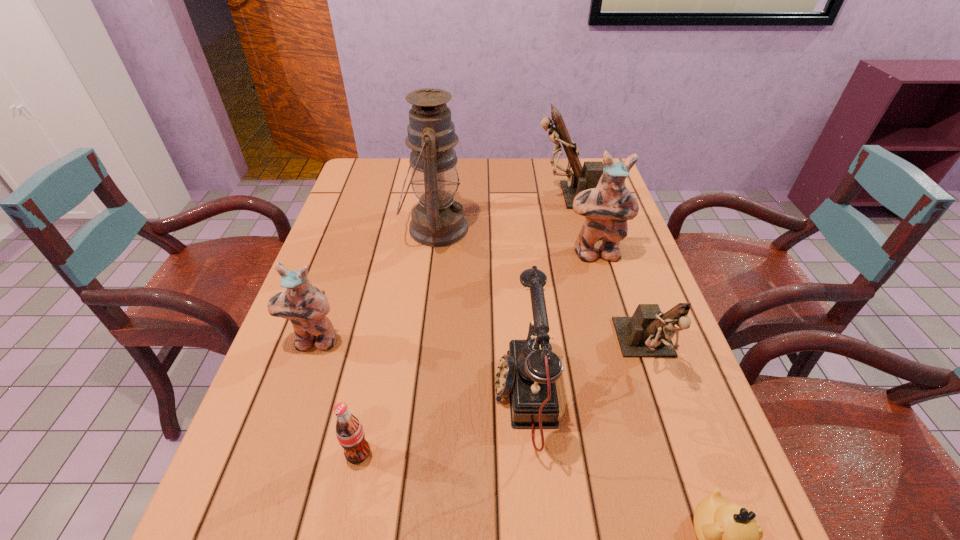
In order to click on the tallest object in this screenshot , I will do `click(437, 221)`.

You are a GUI agent. You are given a task and a screenshot of the screen. Output one action in this format:
    pyautogui.click(x=<x>, y=<y>)
    Task: Click on the brown oil lamp
    This screenshot has height=540, width=960.
    Given the screenshot: What is the action you would take?
    pyautogui.click(x=437, y=221)

This screenshot has width=960, height=540. In order to click on the farther brown figurine in this screenshot , I will do `click(587, 177)`.

Where is `the farthest figurine`? The height and width of the screenshot is (540, 960). the farthest figurine is located at coordinates (587, 177).

The width and height of the screenshot is (960, 540). In order to click on the right pink figurine in this screenshot , I will do `click(606, 208)`.

Where is `the second farthest figurine`? the second farthest figurine is located at coordinates (606, 208).

Where is `black telephone`? black telephone is located at coordinates (527, 374).

Identify the location of telephone. (527, 374).

At what (x,y) coordinates should I click in order to perform the action: click on the leftmost object. Please return your answer as a coordinate pair (x, y). Looking at the image, I should click on (306, 306).

At what (x,y) coordinates should I click in order to perform the action: click on the leftmost figurine. Please return your answer as a coordinate pair (x, y). This screenshot has height=540, width=960. Looking at the image, I should click on (x=306, y=306).